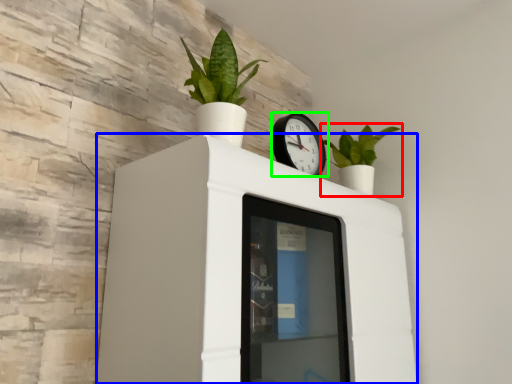
Question: Based on their relative distances, which object is farther from houseplant (highlighted by a red box)? Choose from furniture (highlighted by a blue box) and wall clock (highlighted by a green box).

Choices:
 (A) furniture
 (B) wall clock

Answer: (A)